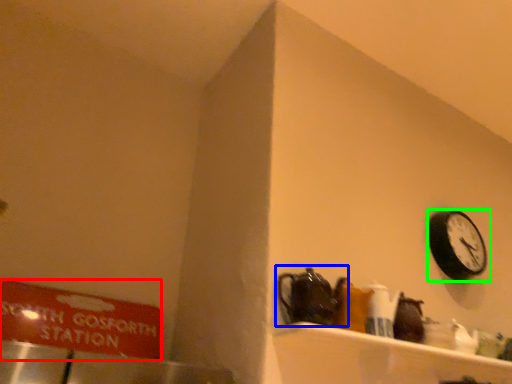
Question: Considering the real-world distances, which object is closest to sign (highlighted by a red box)? tea pot (highlighted by a blue box) or wall clock (highlighted by a green box).

Choices:
 (A) tea pot
 (B) wall clock

Answer: (A)